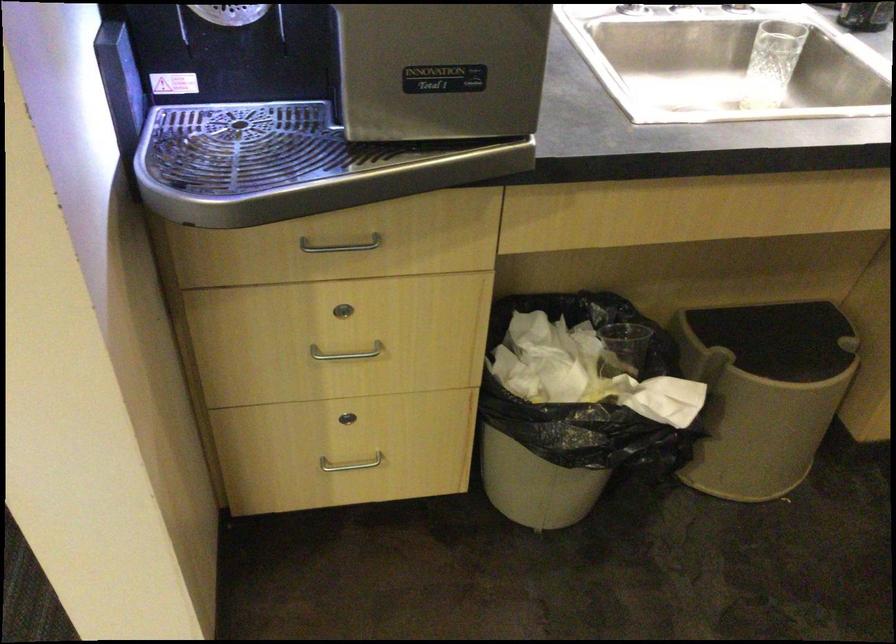
Identify the location of dispenser drip tray. (240, 146).